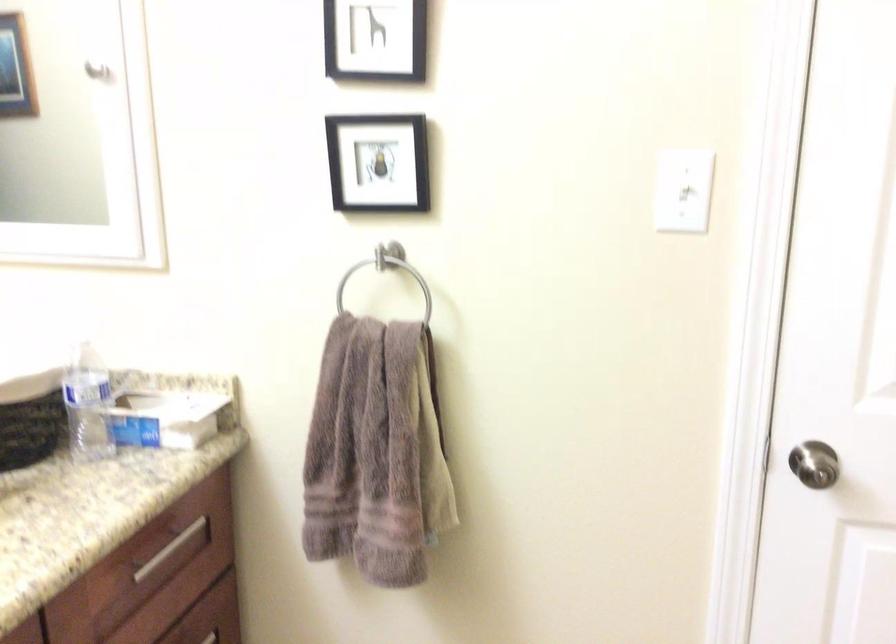
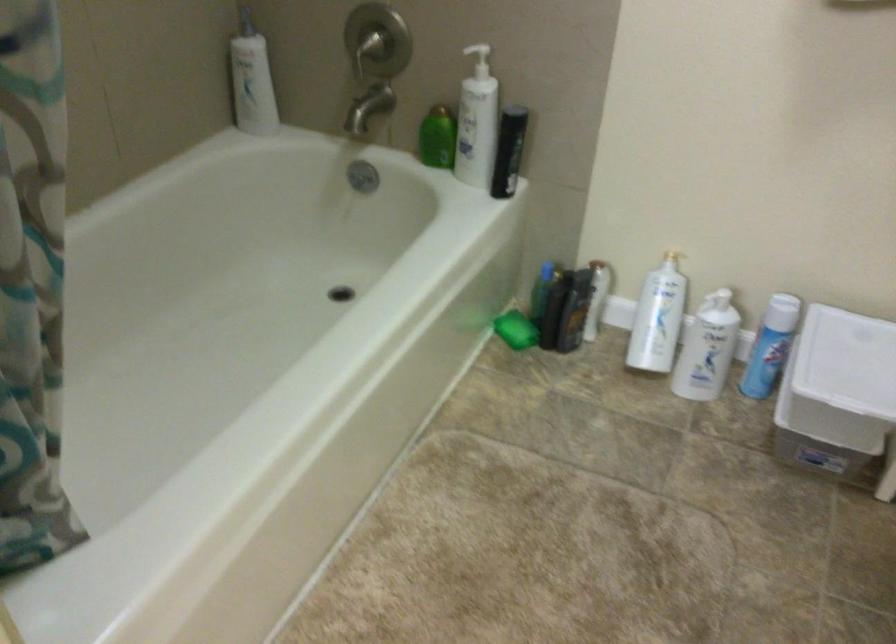
Based on the continuous images, in which direction is the camera rotating?

The camera rotated toward right-down.